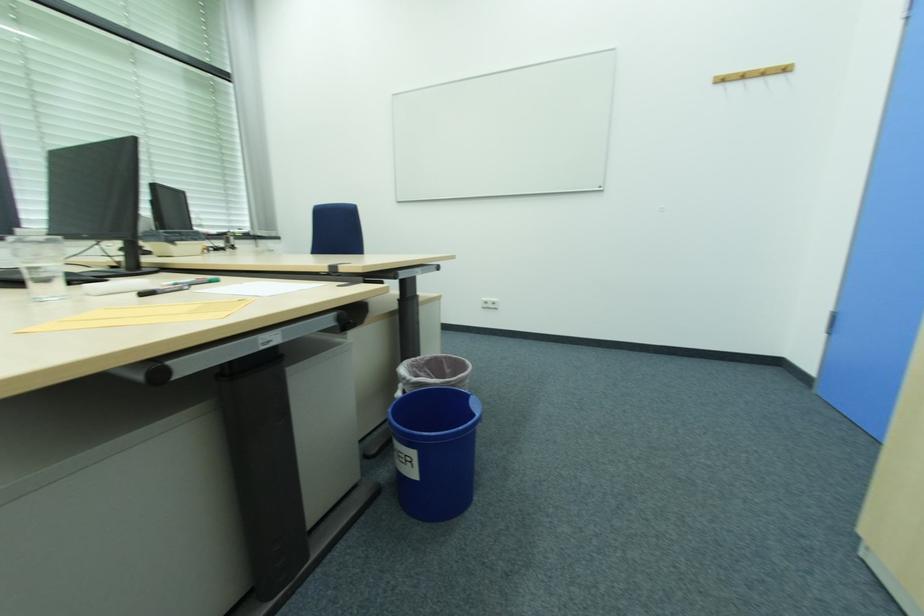
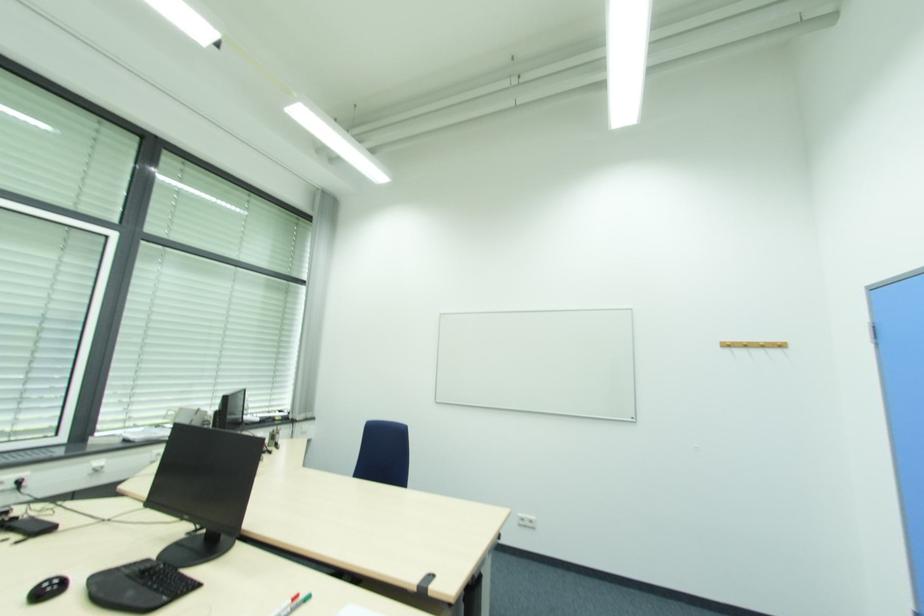
Find the pixel in the second image that matches [723,81] in the first image.

(730, 346)